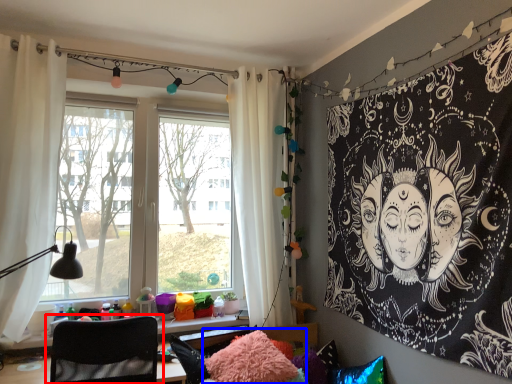
Question: Which object appears closest to the camera in this image, chair (highlighted by a red box) or pillow (highlighted by a blue box)?

Choices:
 (A) chair
 (B) pillow

Answer: (A)